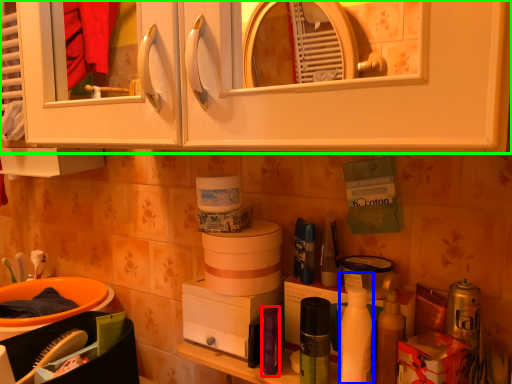
Question: Which is farther away from toiletry (highlighted by a red box)? cleaning product (highlighted by a blue box) or cabinetry (highlighted by a green box)?

Choices:
 (A) cleaning product
 (B) cabinetry

Answer: (B)